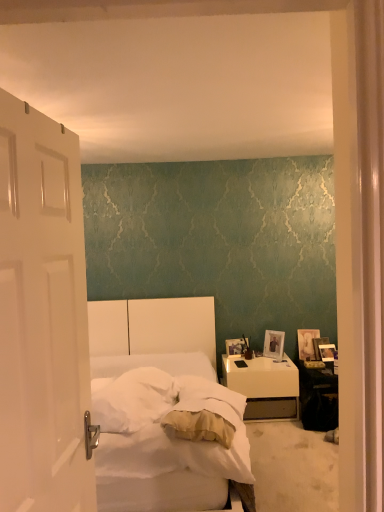
Question: Would you say white glossy nightstand at lower right is a long distance from white soft bedsheet at center?

Choices:
 (A) no
 (B) yes

Answer: (B)

Question: Does white glossy nightstand at lower right have a lesser width compared to white soft bedsheet at center?

Choices:
 (A) no
 (B) yes

Answer: (A)

Question: Can you confirm if white glossy nightstand at lower right is bigger than white soft bedsheet at center?

Choices:
 (A) yes
 (B) no

Answer: (A)

Question: Considering the relative positions of white glossy nightstand at lower right and white soft bedsheet at center in the image provided, is white glossy nightstand at lower right to the right of white soft bedsheet at center from the viewer's perspective?

Choices:
 (A) no
 (B) yes

Answer: (B)

Question: Can you confirm if white glossy nightstand at lower right is smaller than white soft bedsheet at center?

Choices:
 (A) yes
 (B) no

Answer: (B)

Question: Is white glossy nightstand at lower right shorter than white soft bedsheet at center?

Choices:
 (A) no
 (B) yes

Answer: (A)

Question: Does wooden photo frame at right, the 5th picture frame positioned from the right, have a greater height compared to white soft pillow at center?

Choices:
 (A) yes
 (B) no

Answer: (A)

Question: Considering the relative positions of wooden photo frame at right, which ranks as the 1th picture frame in left-to-right order, and white soft pillow at center in the image provided, is wooden photo frame at right, which ranks as the 1th picture frame in left-to-right order, behind white soft pillow at center?

Choices:
 (A) yes
 (B) no

Answer: (A)

Question: Is wooden photo frame at right, the 5th picture frame positioned from the right, not inside white soft pillow at center?

Choices:
 (A) yes
 (B) no

Answer: (A)

Question: From the image's perspective, is wooden photo frame at right, the 5th picture frame positioned from the right, under white soft pillow at center?

Choices:
 (A) yes
 (B) no

Answer: (A)

Question: From a real-world perspective, is wooden photo frame at right, the 5th picture frame positioned from the right, positioned under white soft pillow at center based on gravity?

Choices:
 (A) yes
 (B) no

Answer: (A)

Question: Is wooden photo frame at right, which ranks as the 1th picture frame in left-to-right order, thinner than white soft pillow at center?

Choices:
 (A) yes
 (B) no

Answer: (A)

Question: From a real-world perspective, is wooden photo frame at right, the 3th picture frame positioned from the right, located beneath white soft bedsheet at center?

Choices:
 (A) yes
 (B) no

Answer: (A)